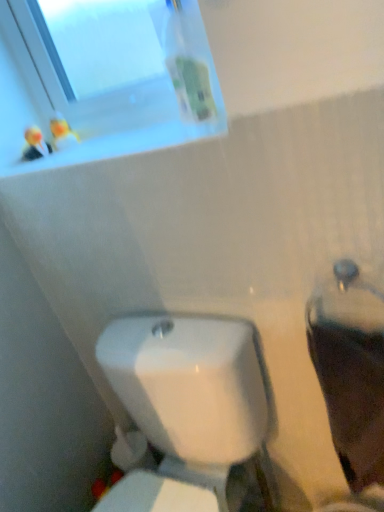
The width and height of the screenshot is (384, 512). In order to click on matte white toilet at right in this screenshot , I will do `click(351, 368)`.

Which of these two, matte white toilet at right or transparent glass window at upper left, stands shorter?

With less height is transparent glass window at upper left.

From the picture: Can you confirm if matte white toilet at right is wider than transparent glass window at upper left?

Yes, matte white toilet at right is wider than transparent glass window at upper left.

Between point (329, 331) and point (117, 142), which one is positioned in front?

Positioned in front is point (329, 331).

Does white glossy toilet at lower center appear on the right side of matte white toilet at right?

No.

Could you tell me if white glossy toilet at lower center is facing matte white toilet at right?

No, white glossy toilet at lower center is not turned towards matte white toilet at right.

Which is behind, point (146, 492) or point (346, 473)?

The point (346, 473) is more distant.

Relative to matte white toilet at right, is transparent glass window at upper left in front or behind?

transparent glass window at upper left is positioned farther from the viewer than matte white toilet at right.

From the image's perspective, is transparent glass window at upper left over matte white toilet at right?

Yes.

Which is more to the left, transparent glass window at upper left or matte white toilet at right?

transparent glass window at upper left.

How many degrees apart are the facing directions of transparent glass window at upper left and matte white toilet at right?

1.78 degrees separate the facing orientations of transparent glass window at upper left and matte white toilet at right.

From the picture: Considering the positions of objects transparent glass window at upper left and white glossy toilet at lower center in the image provided, who is more to the right, transparent glass window at upper left or white glossy toilet at lower center?

Positioned to the right is white glossy toilet at lower center.

From a real-world perspective, which is physically above, transparent glass window at upper left or white glossy toilet at lower center?

transparent glass window at upper left.

Considering the points (92, 46) and (203, 422), which point is in front, point (92, 46) or point (203, 422)?

The point (203, 422) is closer.

Can you confirm if transparent glass window at upper left is thinner than white glossy toilet at lower center?

Yes.

Locate an element on the screen. This screenshot has width=384, height=512. porcelain above the white glossy toilet at lower center (from a real-world perspective) is located at coordinates (351, 368).

Is matte white toilet at right positioned with its back to white glossy toilet at lower center?

No, matte white toilet at right's orientation is not away from white glossy toilet at lower center.

Can you tell me how much matte white toilet at right and white glossy toilet at lower center differ in facing direction?

matte white toilet at right and white glossy toilet at lower center are facing 3.77 degrees away from each other.

From the image's perspective, which one is positioned higher, matte white toilet at right or white glossy toilet at lower center?

matte white toilet at right.

Which point is more forward, (217, 373) or (46, 64)?

The point (217, 373) is closer to the camera.

What's the angular difference between white glossy toilet at lower center and transparent glass window at upper left's facing directions?

There is a 1.99-degree angle between the facing directions of white glossy toilet at lower center and transparent glass window at upper left.

Where is `window to the left of white glossy toilet at lower center`? Image resolution: width=384 pixels, height=512 pixels. window to the left of white glossy toilet at lower center is located at coordinates (106, 78).

Is transparent glass window at upper left at the back of white glossy toilet at lower center?

white glossy toilet at lower center does not have its back to transparent glass window at upper left.

In order to click on window on the left of matte white toilet at right in this screenshot , I will do `click(106, 78)`.

What are the coordinates of `porcelain to the right of white glossy toilet at lower center` in the screenshot? It's located at (351, 368).

From the picture: From the image, which object appears to be farther from transparent glass window at upper left, matte white toilet at right or white glossy toilet at lower center?

matte white toilet at right is positioned further to the anchor transparent glass window at upper left.

Considering their positions, is matte white toilet at right positioned further to white glossy toilet at lower center than transparent glass window at upper left?

The object further to white glossy toilet at lower center is transparent glass window at upper left.

When comparing their distances from matte white toilet at right, does transparent glass window at upper left or white glossy toilet at lower center seem closer?

white glossy toilet at lower center.

When comparing their distances from matte white toilet at right, does white glossy toilet at lower center or transparent glass window at upper left seem further?

transparent glass window at upper left.

Looking at the image, which one is located closer to white glossy toilet at lower center, transparent glass window at upper left or matte white toilet at right?

Among the two, matte white toilet at right is located nearer to white glossy toilet at lower center.

Estimate the real-world distances between objects in this image. Which object is further from transparent glass window at upper left, white glossy toilet at lower center or matte white toilet at right?

matte white toilet at right is positioned further to the anchor transparent glass window at upper left.

I want to click on porcelain between transparent glass window at upper left and white glossy toilet at lower center vertically, so click(351, 368).